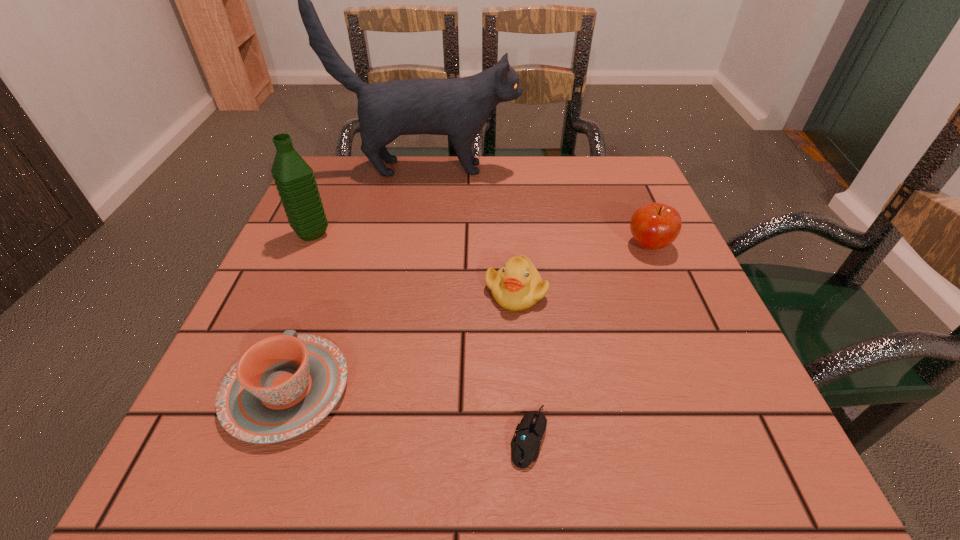
Select which object is the fourth closest to the shortest object. Please provide its 2D coordinates. Your answer should be formatted as a tuple, i.e. [(x, y)], where the tuple contains the x and y coordinates of a point satisfying the conditions above.

[(294, 178)]

This screenshot has width=960, height=540. Find the location of `object that stands as the third closest to the computer mouse`. object that stands as the third closest to the computer mouse is located at coordinates (654, 226).

Find the location of a particular element. The width and height of the screenshot is (960, 540). vacant region that satisfies the following two spatial constraints: 1. on the back side of the apple; 2. on the right side of the shortest object is located at coordinates (513, 245).